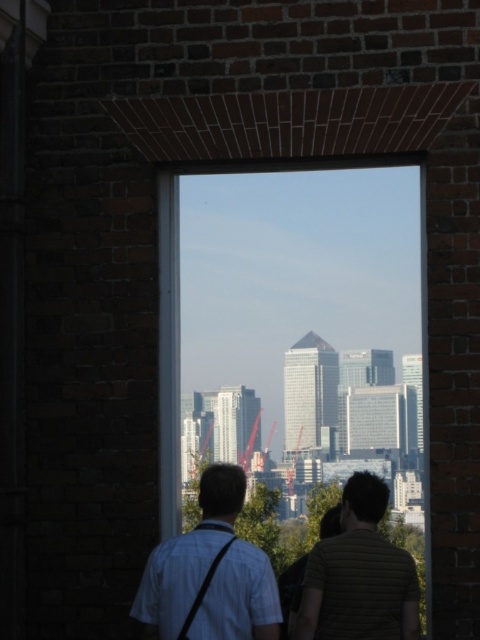
Which is behind, point (383, 588) or point (294, 449)?

The point (294, 449) is behind.

Is point (408, 589) positioned behind point (287, 484)?

No, (408, 589) is in front of (287, 484).

The image size is (480, 640). Find the location of `striped cotton shirt at center`. striped cotton shirt at center is located at coordinates (359, 576).

Does metallic red crane at center have a smaller size compared to reddish metallic crane at center?

Yes.

What do you see at coordinates (250, 444) in the screenshot?
I see `metallic red crane at center` at bounding box center [250, 444].

Locate an element on the screen. metallic red crane at center is located at coordinates (250, 444).

How far apart are transparent glass window at center and striped cotton shirt at center?

transparent glass window at center and striped cotton shirt at center are 94.95 feet apart from each other.

What do you see at coordinates (301, 346) in the screenshot? This screenshot has width=480, height=640. I see `transparent glass window at center` at bounding box center [301, 346].

Which is in front, point (297, 252) or point (317, 600)?

Positioned in front is point (317, 600).

Identify the location of transparent glass window at center. This screenshot has width=480, height=640. (301, 346).